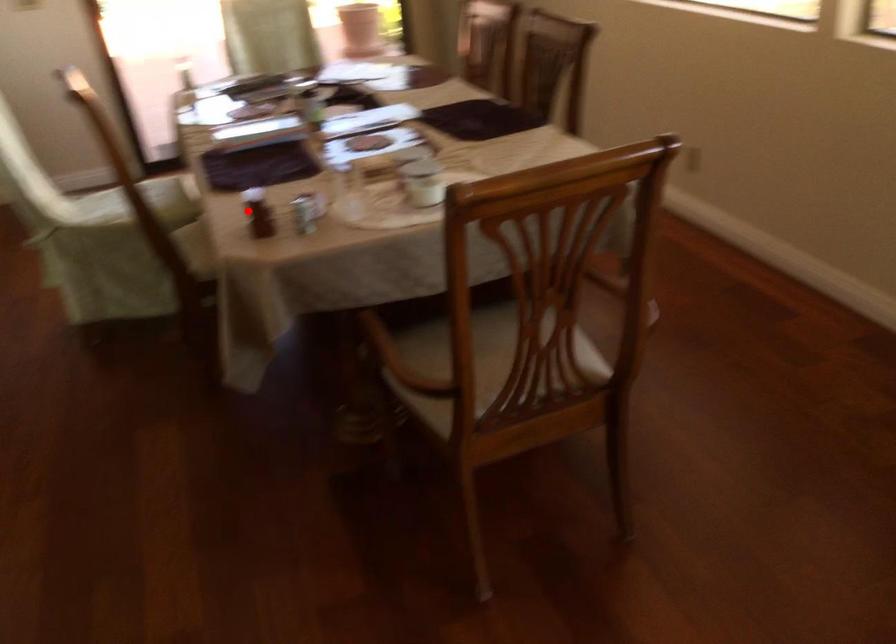
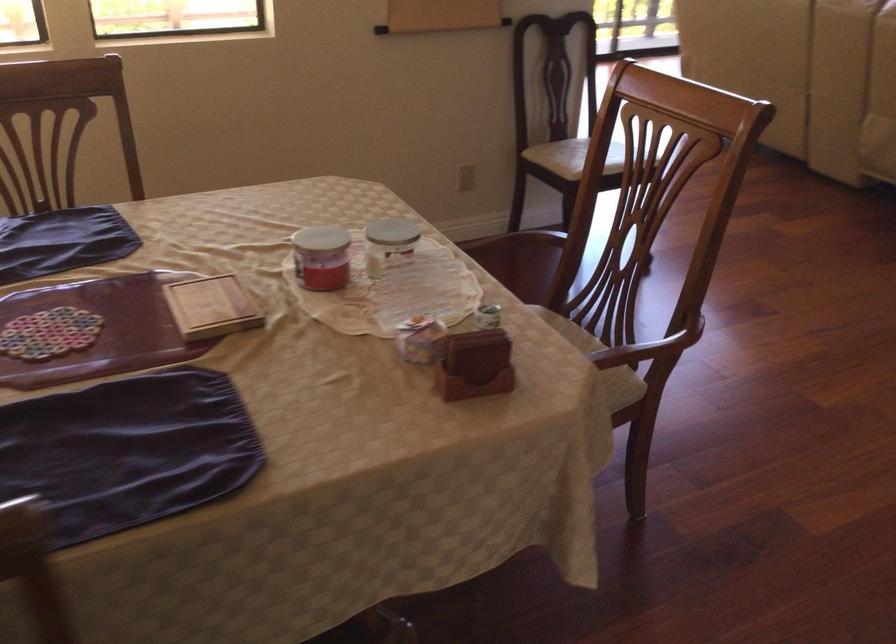
The point at the highlighted location is marked in the first image. Where is the corresponding point in the second image?

(475, 365)